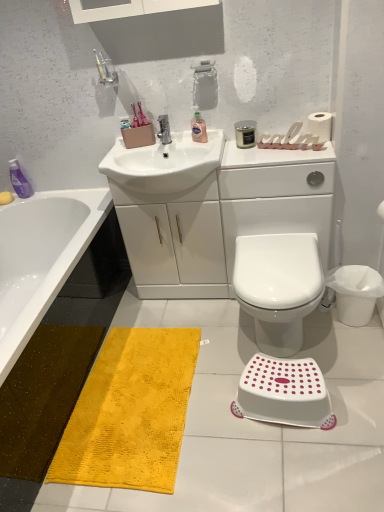
Question: Would you say metallic faucet at center is to the left or to the right of white plastic step stool at lower right in the picture?

Choices:
 (A) right
 (B) left

Answer: (B)

Question: In terms of width, does metallic faucet at center look wider or thinner when compared to white plastic step stool at lower right?

Choices:
 (A) thin
 (B) wide

Answer: (A)

Question: Considering the real-world distances, which object is closest to the white matte toilet paper at upper right?

Choices:
 (A) white glossy sink at center
 (B) white plastic step stool at lower right
 (C) white glossy toilet at center
 (D) translucent pink liquid at sink, arranged as the 2th toiletry when ordered from the bottom
 (E) yellow textured mat at lower left

Answer: (D)

Question: Estimate the real-world distances between objects in this image. Which object is farther from the metallic faucet at center?

Choices:
 (A) matte white bathtub at lower left
 (B) yellow textured mat at lower left
 (C) white glossy toilet at center
 (D) white glossy cabinet at center
 (E) white glossy sink at center

Answer: (B)